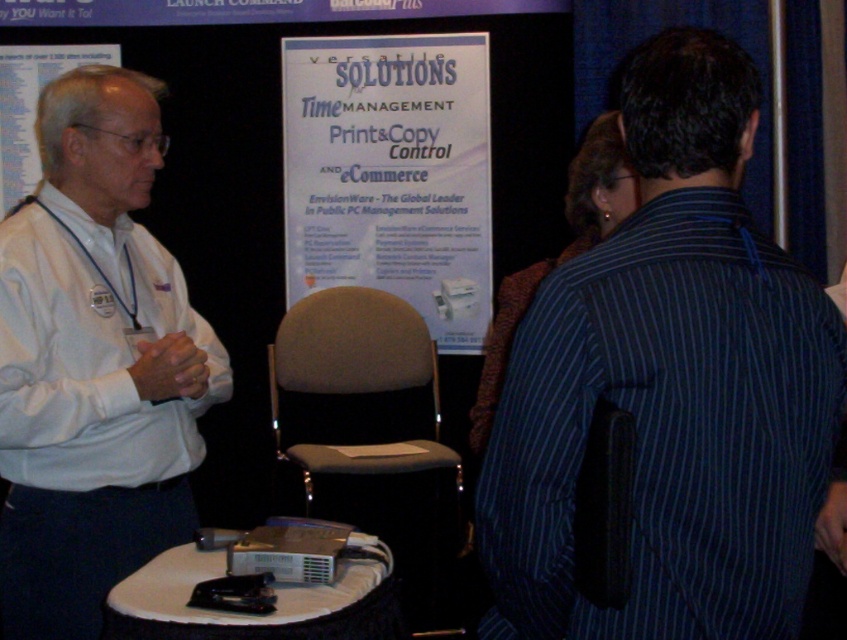
You are an attendee at the conference. You notice the dark blue striped shirt at right and the white paper at center. Which object is smaller in size?

The dark blue striped shirt at right is smaller in size compared to the white paper at center.

You are an attendee at the conference and you want to take a photo of the white shirt at left and the white paper at upper left. Which object should you focus on first if you want to capture both in the same frame without moving your camera?

The white shirt at left has a greater height compared to the white paper at upper left, so you should focus on the white shirt at left first to ensure both are in frame.

You are attending a conference and need to present your materials. You have two white papers to choose from on the table. The white paper at center and the white paper at upper left. Which one is taller?

The white paper at center has a greater height compared to white paper at upper left, so the white paper at center is taller.